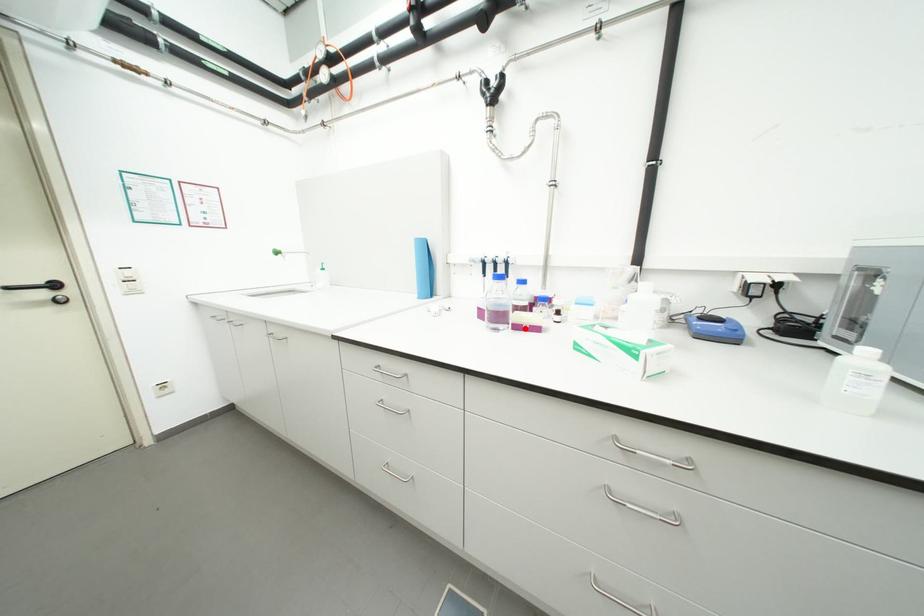
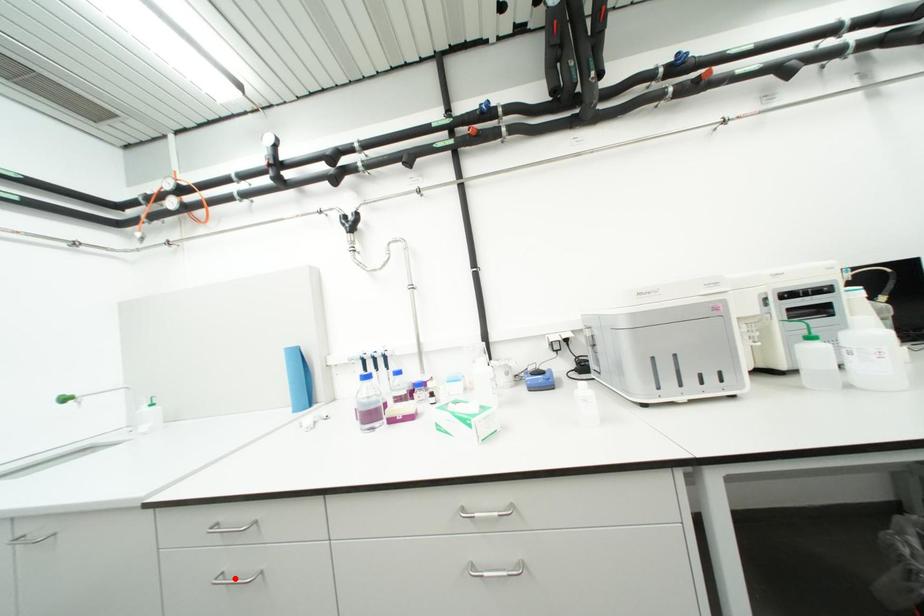
I am providing you with two images of the same scene from different viewpoints. A red point is marked on the first image and another point is marked on the second image. Is the red point in image1 aligned with the point shown in image2?

No